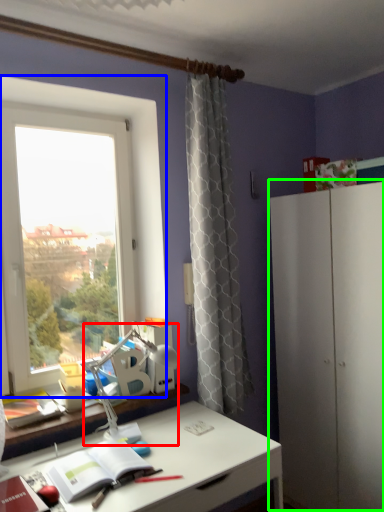
Question: Which object is positioned closest to table lamp (highlighted by a red box)? Select from window (highlighted by a blue box) and dresser (highlighted by a green box).

Choices:
 (A) window
 (B) dresser

Answer: (A)